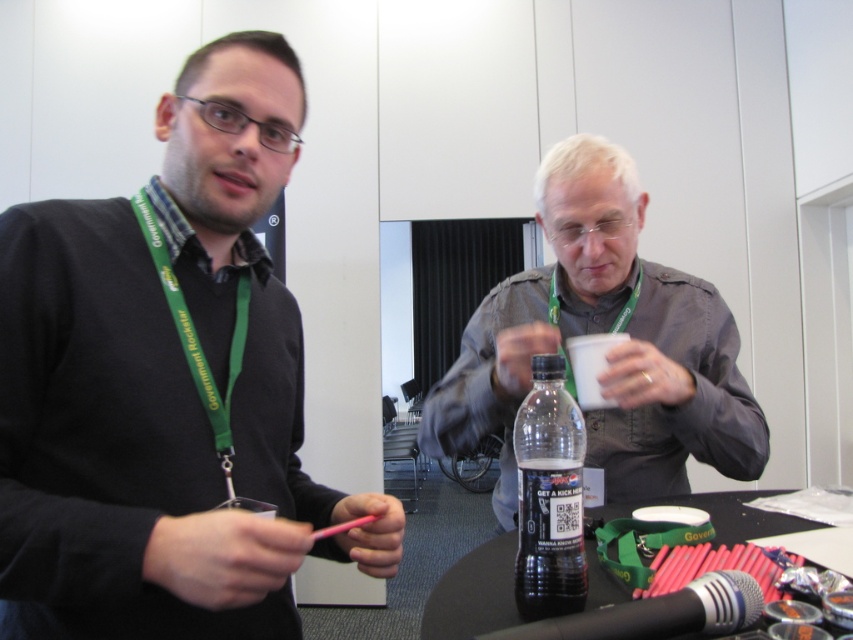
Is gray matte shirt at center further to camera compared to black plastic bottle at center?

Yes, gray matte shirt at center is behind black plastic bottle at center.

Is gray matte shirt at center thinner than black plastic bottle at center?

Yes.

I want to click on gray matte shirt at center, so click(x=604, y=332).

Image resolution: width=853 pixels, height=640 pixels. I want to click on gray matte shirt at center, so click(x=604, y=332).

Is point (80, 593) farther from viewer compared to point (807, 525)?

No.

Does matte black sweater at left appear on the right side of black plastic bottle at center?

No, matte black sweater at left is not to the right of black plastic bottle at center.

Image resolution: width=853 pixels, height=640 pixels. What are the coordinates of `matte black sweater at left` in the screenshot? It's located at (167, 385).

I want to click on matte black sweater at left, so click(167, 385).

Does clear plastic bottle at center have a smaller size compared to black plastic bottle at center?

Correct, clear plastic bottle at center occupies less space than black plastic bottle at center.

Does clear plastic bottle at center come in front of black plastic bottle at center?

No, it is behind black plastic bottle at center.

Is point (526, 412) more distant than point (486, 548)?

No, (526, 412) is closer to viewer.

Locate an element on the screen. clear plastic bottle at center is located at coordinates (549, 497).